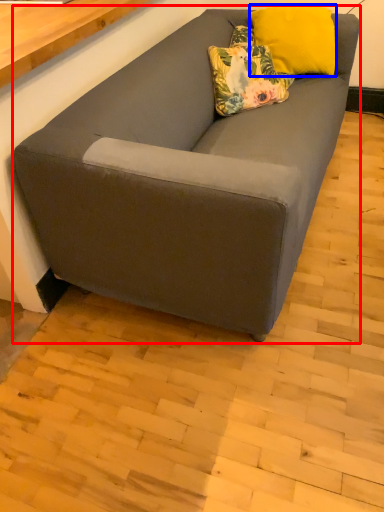
Question: Among these objects, which one is farthest to the camera, studio couch (highlighted by a red box) or pillow (highlighted by a blue box)?

Choices:
 (A) studio couch
 (B) pillow

Answer: (B)